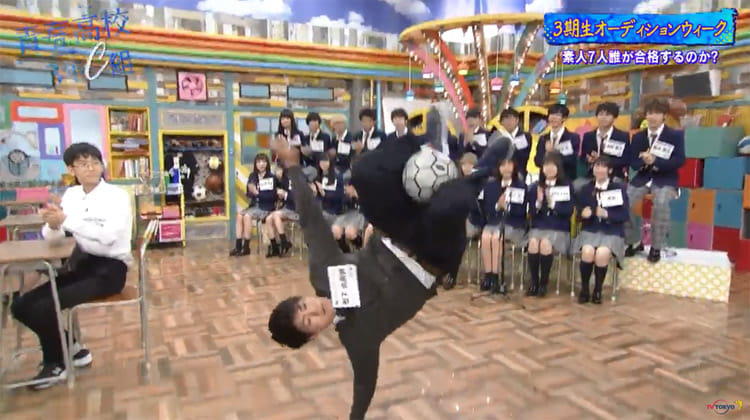
Where is `floor`? floor is located at coordinates (477, 340).